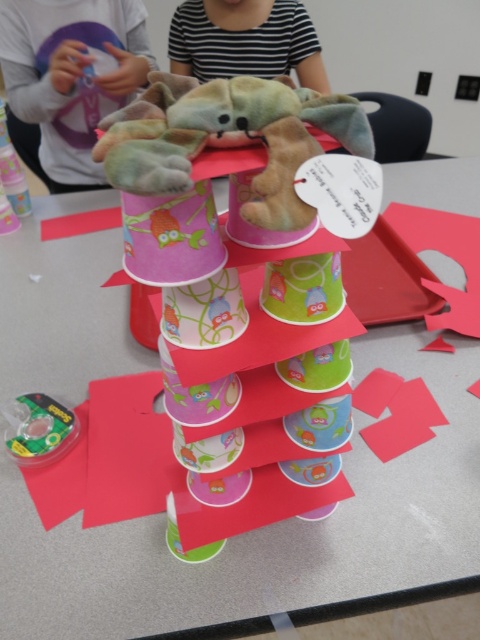
You are organizing a childrens party and need to decide which toy to place on top of the cup tower. The striped fabric stuffed animal at upper center and the green plastic toy at lower left are both available. Which toy should you choose to ensure stability?

The striped fabric stuffed animal at upper center is larger in size than the green plastic toy at lower left, so placing the striped fabric stuffed animal at upper center on top of the cup tower would provide better stability due to its larger base.

You are an artist trying to place a sticker on the craft project. You have two points to choose from, point (256, 35) and point (50, 433). Which point is closer to the viewer?

Point (50, 433) is closer to the viewer because it is in front of point (256, 35).